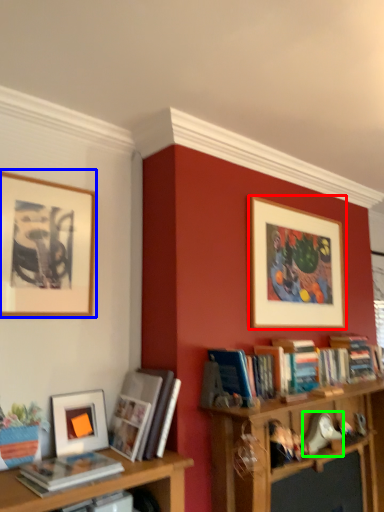
Question: Estimate the real-world distances between objects in this image. Which object is closer to picture frame (highlighted by a red box), picture frame (highlighted by a blue box) or toy (highlighted by a green box)?

Choices:
 (A) picture frame
 (B) toy

Answer: (B)